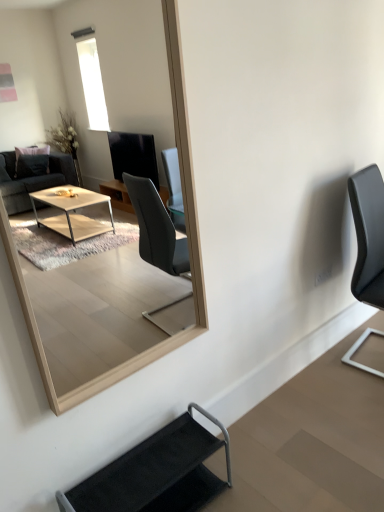
Question: Considering the positions of point (230, 471) and point (114, 71), is point (230, 471) closer or farther from the camera than point (114, 71)?

Choices:
 (A) closer
 (B) farther

Answer: (A)

Question: Considering the positions of black fabric chair at lower center, marked as the second chair in a right-to-left arrangement, and light wood mirror at upper center in the image, is black fabric chair at lower center, marked as the second chair in a right-to-left arrangement, wider or thinner than light wood mirror at upper center?

Choices:
 (A) wide
 (B) thin

Answer: (A)

Question: Estimate the real-world distances between objects in this image. Which object is closer to the black leather chair at right, marked as the 1th chair in a right-to-left arrangement?

Choices:
 (A) light wood mirror at upper center
 (B) black fabric chair at lower center, the 2th chair positioned from the top

Answer: (B)

Question: Which is farther from the black leather chair at right, the 2th chair viewed from the front?

Choices:
 (A) light wood mirror at upper center
 (B) black fabric chair at lower center, marked as the 2th chair in a back-to-front arrangement

Answer: (A)